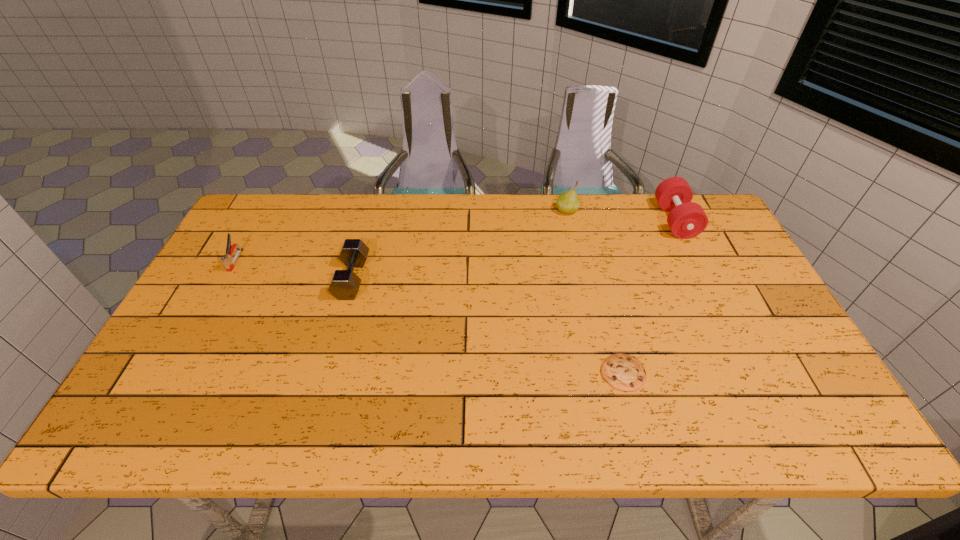
The height and width of the screenshot is (540, 960). Identify the location of pear. (568, 202).

Where is `the taller dumbbell`? The width and height of the screenshot is (960, 540). the taller dumbbell is located at coordinates (686, 219).

The image size is (960, 540). Find the location of `the second tallest object`. the second tallest object is located at coordinates (686, 219).

Find the location of `the leftmost object`. the leftmost object is located at coordinates (227, 260).

At what (x,y) coordinates should I click in order to perform the action: click on the shorter dumbbell. Please return your answer as a coordinate pair (x, y). Looking at the image, I should click on (345, 284).

You are a GUI agent. You are given a task and a screenshot of the screen. Output one action in this format:
    pyautogui.click(x=<x>, y=<y>)
    Task: Click on the left dumbbell
    
    Given the screenshot: What is the action you would take?
    pyautogui.click(x=345, y=284)

The height and width of the screenshot is (540, 960). In order to click on cookie in this screenshot , I will do `click(624, 372)`.

At what (x,y) coordinates should I click in order to perform the action: click on the shortest object. Please return your answer as a coordinate pair (x, y). The height and width of the screenshot is (540, 960). Looking at the image, I should click on (624, 372).

Find the location of a particular element. The image size is (960, 540). free location located on the front of the pear is located at coordinates (579, 263).

Identify the location of free space located 0.300m on the left of the farther dumbbell. click(x=568, y=220).